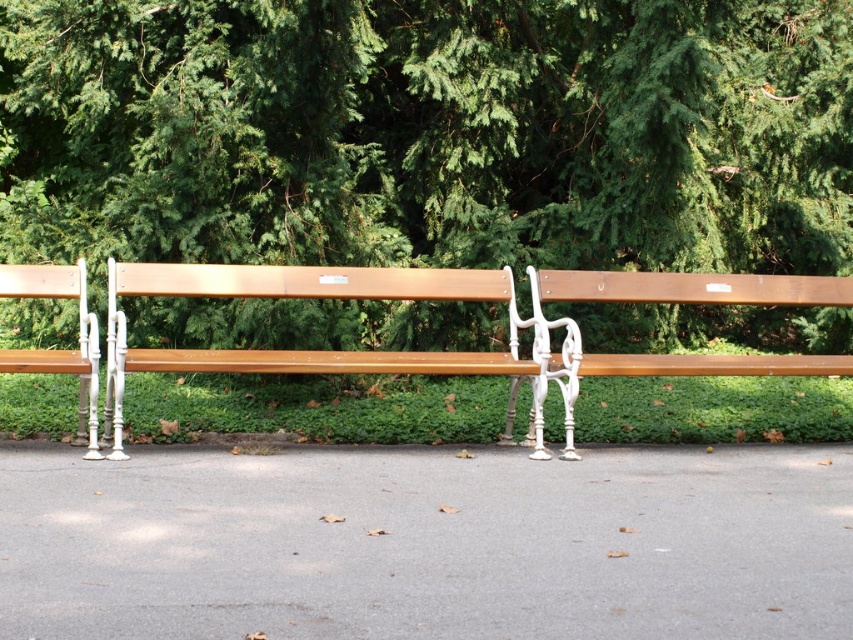
You are planning to sit on one of the two benches in the park. The wooden bench at center and the matte wood bench at left are both available. Which bench offers more seating space?

The wooden bench at center is bigger than the matte wood bench at left, so it offers more seating space.

You are a gardener who needs to water the green leafy tree at upper center. You have a watering can that can spray water up to 3 meters. Are you able to water the tree from the position of the matte wood bench at right without moving closer?

The distance between the green leafy tree at upper center and the matte wood bench at right is 2.99 meters, which is within the 3 meter range of the watering can. Therefore, the gardener can water the tree from the bench position without moving closer.

You are standing on the pathway between the two park benches and want to walk towards the point marked at coordinates point (135,64) and point (668,273). Which point should you head towards if you want to move away from the benches?

Point (135,64) is behind point (668,273), so if you want to move away from the benches, you should head towards point (135,64) because it is further back and away from the benches.